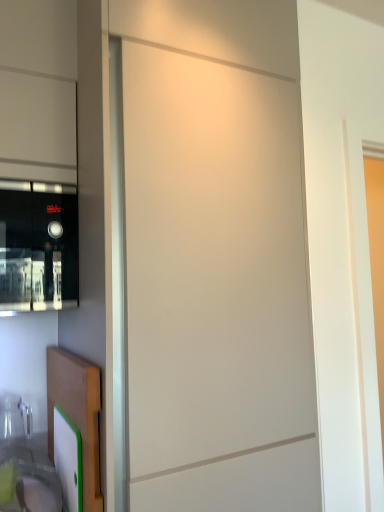
Question: Considering the positions of point (130, 314) and point (1, 290), is point (130, 314) closer or farther from the camera than point (1, 290)?

Choices:
 (A) farther
 (B) closer

Answer: (B)

Question: Looking at the image, does matte white screen door at center seem bigger or smaller compared to black glass microwave at left?

Choices:
 (A) small
 (B) big

Answer: (B)

Question: Estimate the real-world distances between objects in this image. Which object is closer to the matte white screen door at center?

Choices:
 (A) black glass microwave at left
 (B) translucent plastic sink at lower left
 (C) wooden cutting board at lower left

Answer: (C)

Question: Estimate the real-world distances between objects in this image. Which object is farther from the black glass microwave at left?

Choices:
 (A) wooden cutting board at lower left
 (B) matte white screen door at center
 (C) translucent plastic sink at lower left

Answer: (C)